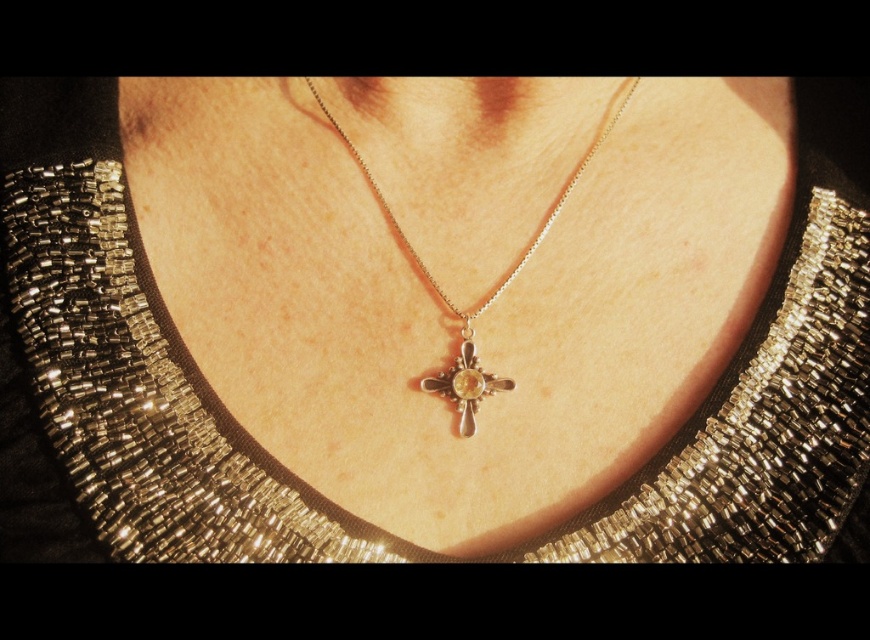
Which is below, silver/golden cross at center or gold metallic cross at center?

Positioned lower is gold metallic cross at center.

What do you see at coordinates (480, 301) in the screenshot? I see `silver/golden cross at center` at bounding box center [480, 301].

Find the location of a particular element. This screenshot has height=640, width=870. silver/golden cross at center is located at coordinates (480, 301).